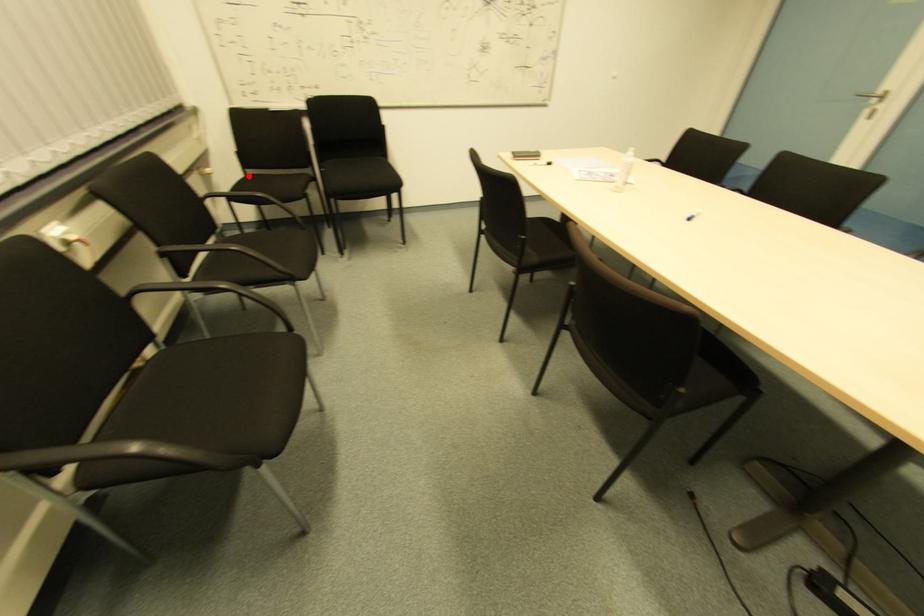
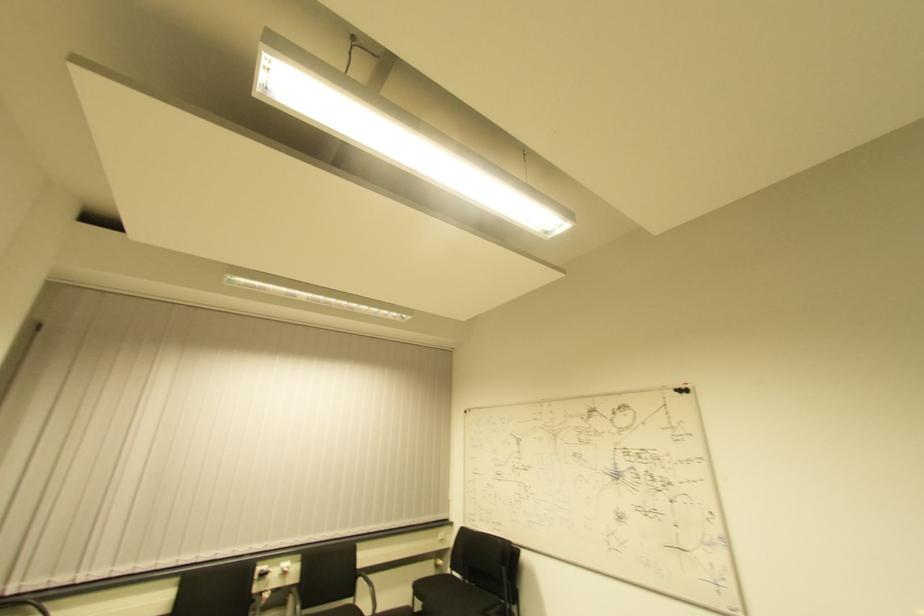
In the second image, find the point that corresponds to the highlighted location in the first image.

(454, 576)